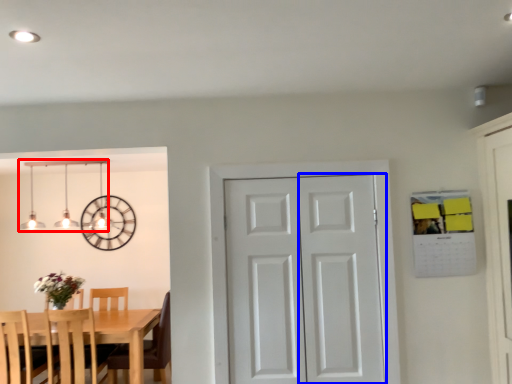
Question: Which object appears farthest to the camera in this image, lamp (highlighted by a red box) or screen door (highlighted by a blue box)?

Choices:
 (A) lamp
 (B) screen door

Answer: (A)